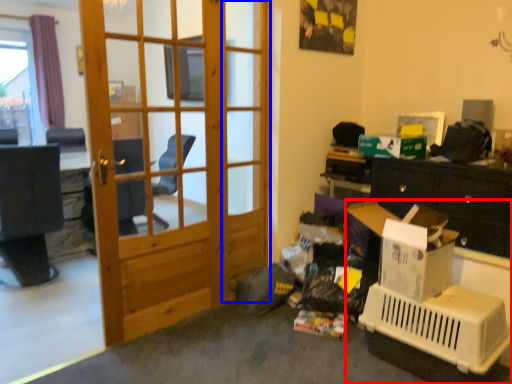
Question: Which object is further to the camera taking this photo, desk (highlighted by a red box) or screen door (highlighted by a blue box)?

Choices:
 (A) desk
 (B) screen door

Answer: (B)